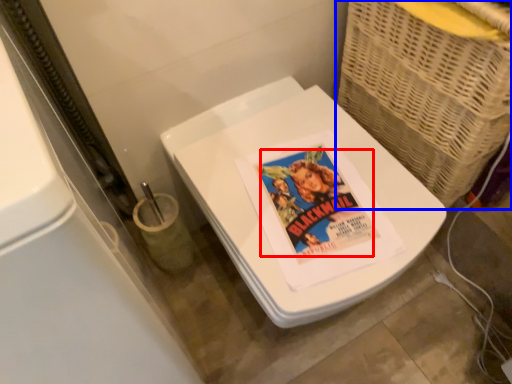
Question: Which point is closer to the camera, comic book character (highlighted by a red box) or basket (highlighted by a blue box)?

Choices:
 (A) comic book character
 (B) basket

Answer: (B)